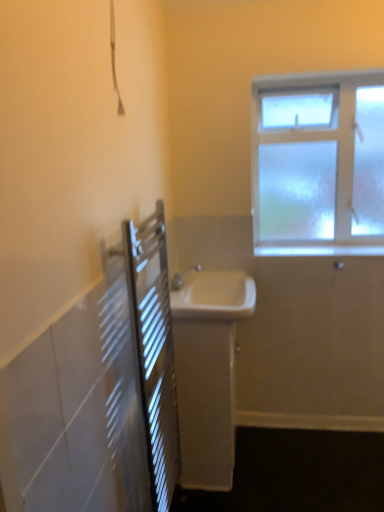
Where is `frosted glass window at upper right`? The width and height of the screenshot is (384, 512). frosted glass window at upper right is located at coordinates (318, 164).

Identify the location of white glossy window sill at upper right. This screenshot has width=384, height=512. (319, 250).

Find the location of `white glossy sink at center, acting as the second sink starting from the bottom`. white glossy sink at center, acting as the second sink starting from the bottom is located at coordinates (213, 296).

This screenshot has height=512, width=384. I want to click on metallic silver radiator at left, so click(154, 349).

Consider the image. Between white glossy window sill at upper right and frosted glass window at upper right, which one has more height?

frosted glass window at upper right.

From a real-world perspective, does white glossy window sill at upper right stand above frosted glass window at upper right?

No.

Is white glossy window sill at upper right surrounding frosted glass window at upper right?

Definitely not — frosted glass window at upper right is not inside white glossy window sill at upper right.

Find the location of a particular element. This screenshot has width=384, height=512. window located above the white glossy window sill at upper right (from the image's perspective) is located at coordinates (318, 164).

Is white glossy sink at center, the first sink ordered from the bottom, directly adjacent to metallic silver radiator at left?

No, white glossy sink at center, the first sink ordered from the bottom, is not in contact with metallic silver radiator at left.

From the image's perspective, which is below, white glossy sink at center, the first sink ordered from the bottom, or metallic silver radiator at left?

white glossy sink at center, the first sink ordered from the bottom.

Is white glossy sink at center, which is the second sink in top-to-bottom order, positioned with its back to metallic silver radiator at left?

No, metallic silver radiator at left is not at the back of white glossy sink at center, which is the second sink in top-to-bottom order.

Is point (211, 423) positioned behind point (125, 264)?

That is True.

Consider the image. Considering the relative positions of metallic silver radiator at left and white glossy sink at center, acting as the 1th sink starting from the top, in the image provided, is metallic silver radiator at left to the left of white glossy sink at center, acting as the 1th sink starting from the top, from the viewer's perspective?

Yes, metallic silver radiator at left is to the left of white glossy sink at center, acting as the 1th sink starting from the top.

Looking at their sizes, would you say metallic silver radiator at left is wider or thinner than white glossy sink at center, acting as the second sink starting from the bottom?

metallic silver radiator at left is thinner than white glossy sink at center, acting as the second sink starting from the bottom.

Considering the relative positions of metallic silver radiator at left and white glossy sink at center, acting as the second sink starting from the bottom, in the image provided, is metallic silver radiator at left behind white glossy sink at center, acting as the second sink starting from the bottom,?

No, metallic silver radiator at left is closer to the viewer.

From a real-world perspective, does metallic silver radiator at left sit lower than white glossy sink at center, acting as the second sink starting from the bottom?

Correct, in the physical world, metallic silver radiator at left is lower than white glossy sink at center, acting as the second sink starting from the bottom.

Is metallic silver radiator at left positioned with its back to white glossy sink at center, which is the second sink in top-to-bottom order?

No, metallic silver radiator at left is not facing away from white glossy sink at center, which is the second sink in top-to-bottom order.

Considering the points (161, 429) and (221, 485), which point is behind, point (161, 429) or point (221, 485)?

The point (221, 485) is more distant.

Which of these two, metallic silver radiator at left or white glossy sink at center, the first sink ordered from the bottom, stands shorter?

Standing shorter between the two is white glossy sink at center, the first sink ordered from the bottom.

Between white glossy sink at center, acting as the 1th sink starting from the top, and frosted glass window at upper right, which one has larger width?

With larger width is white glossy sink at center, acting as the 1th sink starting from the top.

From a real-world perspective, does white glossy sink at center, acting as the second sink starting from the bottom, stand above frosted glass window at upper right?

No, from a real-world perspective, white glossy sink at center, acting as the second sink starting from the bottom, is not above frosted glass window at upper right.

Which point is more forward, (177, 302) or (306, 243)?

The point (177, 302) is closer.

Is white glossy window sill at upper right not near white glossy sink at center, acting as the 1th sink starting from the top?

No, there isn't a large distance between white glossy window sill at upper right and white glossy sink at center, acting as the 1th sink starting from the top.

Considering the relative sizes of white glossy window sill at upper right and white glossy sink at center, acting as the second sink starting from the bottom, in the image provided, is white glossy window sill at upper right thinner than white glossy sink at center, acting as the second sink starting from the bottom,?

Correct, the width of white glossy window sill at upper right is less than that of white glossy sink at center, acting as the second sink starting from the bottom.

Is point (350, 246) behind point (198, 290)?

Yes, point (350, 246) is behind point (198, 290).

Is white glossy window sill at upper right bigger than white glossy sink at center, acting as the second sink starting from the bottom?

Incorrect, white glossy window sill at upper right is not larger than white glossy sink at center, acting as the second sink starting from the bottom.

Can white glossy window sill at upper right be found inside metallic silver radiator at left?

No.

Considering the relative positions of metallic silver radiator at left and white glossy window sill at upper right in the image provided, is metallic silver radiator at left to the left of white glossy window sill at upper right from the viewer's perspective?

Correct, you'll find metallic silver radiator at left to the left of white glossy window sill at upper right.

This screenshot has height=512, width=384. I want to click on window sill that is on the right side of metallic silver radiator at left, so click(319, 250).

Which of these two, metallic silver radiator at left or white glossy window sill at upper right, is wider?

white glossy window sill at upper right.

Locate an element on the screen. window located on the right of white glossy window sill at upper right is located at coordinates (318, 164).

Which sink is the 2nd one when counting from the back of the metallic silver radiator at left? Please provide its 2D coordinates.

[(207, 371)]

Based on the photo, from the image, which object appears to be nearer to white glossy window sill at upper right, white glossy sink at center, acting as the second sink starting from the bottom, or metallic silver radiator at left?

The object closer to white glossy window sill at upper right is white glossy sink at center, acting as the second sink starting from the bottom.

From the image, which object appears to be farther from frosted glass window at upper right, white glossy sink at center, the first sink ordered from the bottom, or white glossy sink at center, acting as the 1th sink starting from the top?

white glossy sink at center, the first sink ordered from the bottom, lies further to frosted glass window at upper right than the other object.

From the image, which object appears to be nearer to white glossy window sill at upper right, white glossy sink at center, which is the second sink in top-to-bottom order, or white glossy sink at center, acting as the second sink starting from the bottom?

white glossy sink at center, acting as the second sink starting from the bottom, is positioned closer to the anchor white glossy window sill at upper right.

From the image, which object appears to be nearer to white glossy sink at center, which is the second sink in top-to-bottom order, white glossy window sill at upper right or white glossy sink at center, acting as the second sink starting from the bottom?

white glossy sink at center, acting as the second sink starting from the bottom, is closer to white glossy sink at center, which is the second sink in top-to-bottom order.

Estimate the real-world distances between objects in this image. Which object is closer to white glossy sink at center, acting as the 1th sink starting from the top, frosted glass window at upper right or white glossy window sill at upper right?

white glossy window sill at upper right lies closer to white glossy sink at center, acting as the 1th sink starting from the top, than the other object.

Considering their positions, is white glossy window sill at upper right positioned further to metallic silver radiator at left than white glossy sink at center, the first sink ordered from the bottom?

The object further to metallic silver radiator at left is white glossy window sill at upper right.

Estimate the real-world distances between objects in this image. Which object is further from white glossy window sill at upper right, metallic silver radiator at left or white glossy sink at center, acting as the second sink starting from the bottom?

metallic silver radiator at left is positioned further to the anchor white glossy window sill at upper right.

From the image, which object appears to be nearer to white glossy sink at center, the first sink ordered from the bottom, frosted glass window at upper right or white glossy window sill at upper right?

Among the two, white glossy window sill at upper right is located nearer to white glossy sink at center, the first sink ordered from the bottom.

You are a GUI agent. You are given a task and a screenshot of the screen. Output one action in this format:
    pyautogui.click(x=<x>, y=<y>)
    Task: Click on the screen door between frosted glass window at upper right and white glossy sink at center, the first sink ordered from the bottom, from top to bottom
    The image size is (384, 512).
    Given the screenshot: What is the action you would take?
    pyautogui.click(x=154, y=349)

You are a GUI agent. You are given a task and a screenshot of the screen. Output one action in this format:
    pyautogui.click(x=<x>, y=<y>)
    Task: Click on the sink between frosted glass window at upper right and white glossy sink at center, the first sink ordered from the bottom, from top to bottom
    The image size is (384, 512).
    Given the screenshot: What is the action you would take?
    [213, 296]

You are a GUI agent. You are given a task and a screenshot of the screen. Output one action in this format:
    pyautogui.click(x=<x>, y=<y>)
    Task: Click on the sink that lies between frosted glass window at upper right and metallic silver radiator at left from top to bottom
    Image resolution: width=384 pixels, height=512 pixels.
    Given the screenshot: What is the action you would take?
    pyautogui.click(x=213, y=296)

Where is `sink between white glossy sink at center, the first sink ordered from the bottom, and white glossy window sill at upper right, in the horizontal direction`? sink between white glossy sink at center, the first sink ordered from the bottom, and white glossy window sill at upper right, in the horizontal direction is located at coordinates (213, 296).